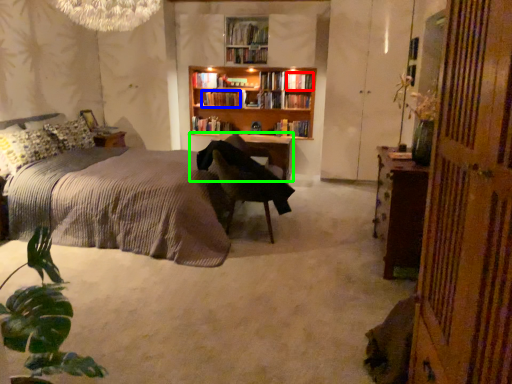
Question: Which object is positioned closest to book (highlighted by a red box)? Select from book (highlighted by a blue box) and table (highlighted by a green box).

Choices:
 (A) book
 (B) table

Answer: (A)